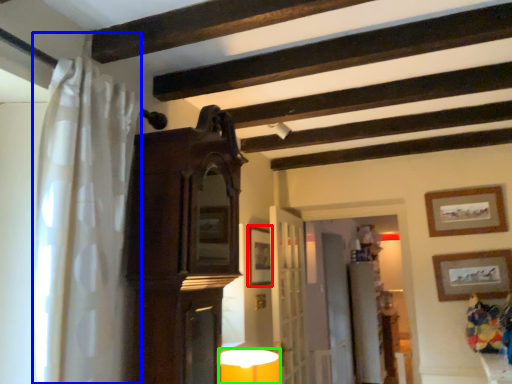
Question: Which object is positioned farthest from picture frame (highlighted by a red box)? Select from shower curtain (highlighted by a blue box) and table lamp (highlighted by a green box).

Choices:
 (A) shower curtain
 (B) table lamp

Answer: (A)